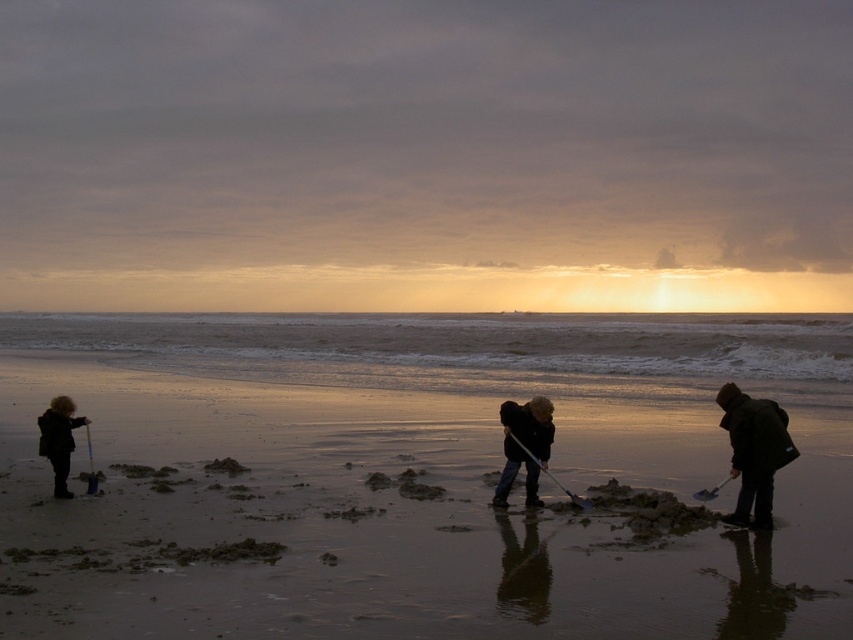
Does sandy beach at center appear on the left side of dark brown wool coat at right?

Indeed, sandy beach at center is positioned on the left side of dark brown wool coat at right.

Is point (351, 396) positioned in front of point (743, 518)?

No, (351, 396) is further to viewer.

Identify the location of sandy beach at center. The width and height of the screenshot is (853, 640). (434, 524).

Who is more distant from viewer, (734, 384) or (727, 477)?

The point (734, 384) is behind.

Does point (764, 468) lie in front of point (712, 493)?

Yes.

This screenshot has height=640, width=853. Describe the element at coordinates (753, 451) in the screenshot. I see `dark brown wool coat at right` at that location.

The height and width of the screenshot is (640, 853). Find the location of `dark brown wool coat at right`. dark brown wool coat at right is located at coordinates (753, 451).

Is dark brown wool coat at right below dark blue jeans at center?

Incorrect, dark brown wool coat at right is not positioned below dark blue jeans at center.

Can you confirm if dark brown wool coat at right is thinner than dark blue jeans at center?

Incorrect, dark brown wool coat at right's width is not less than dark blue jeans at center's.

The width and height of the screenshot is (853, 640). In order to click on dark brown wool coat at right in this screenshot , I will do `click(753, 451)`.